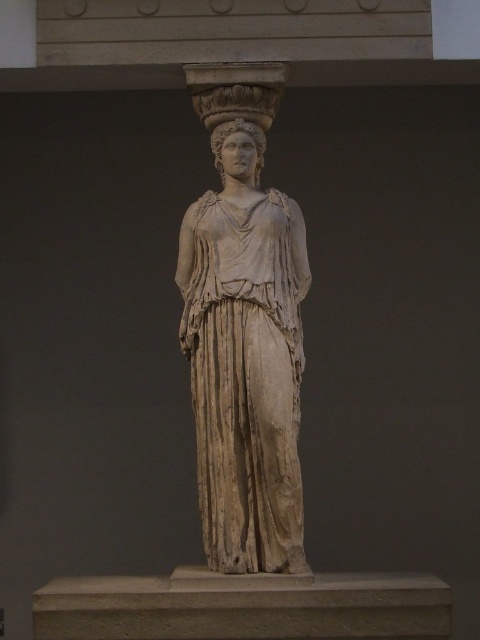
In the scene shown: You are an art student analyzing the classical Greek statue in the museum. You notice the beige stone statue at center and the smooth white head at center. Which part of the statue is nearer to you?

The beige stone statue at center is closer to the viewer than the smooth white head at center.

You are an art student standing in a museum and want to sketch the beige stone statue at center. To do this, you need to position yourself directly in front of it. Given that the statue is at coordinates point 0.561, 0.510, where should you stand relative to the statue to ensure you are facing it head on?

To face the beige stone statue at center head on, you should stand directly in front of it at coordinates point [244,358], ensuring your viewpoint aligns with the statue.

You are an art student observing a classical Greek statue in a museum. You notice the beige stone statue at center and the smooth white head at center. Which object is located to the right of the other?

The beige stone statue at center is positioned on the right side of smooth white head at center.